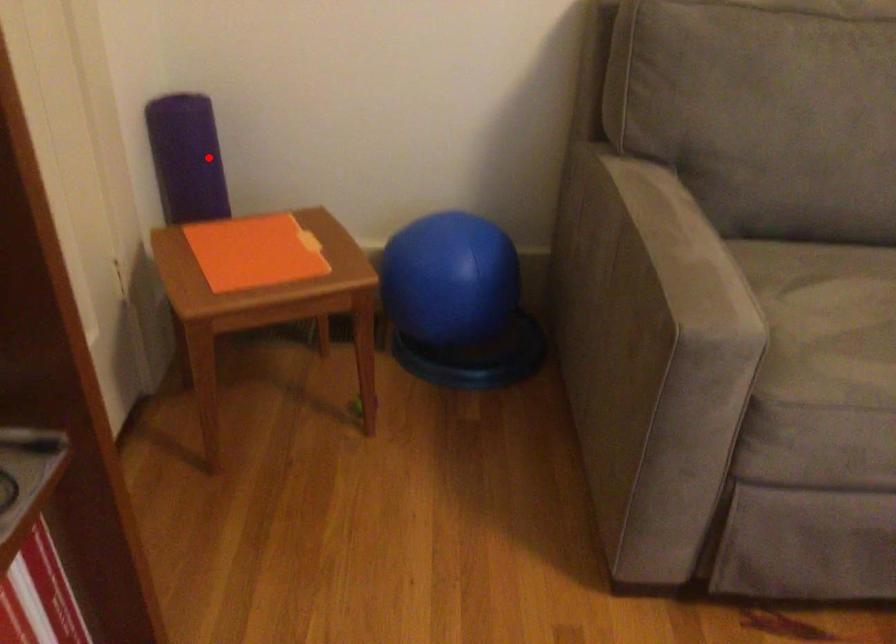
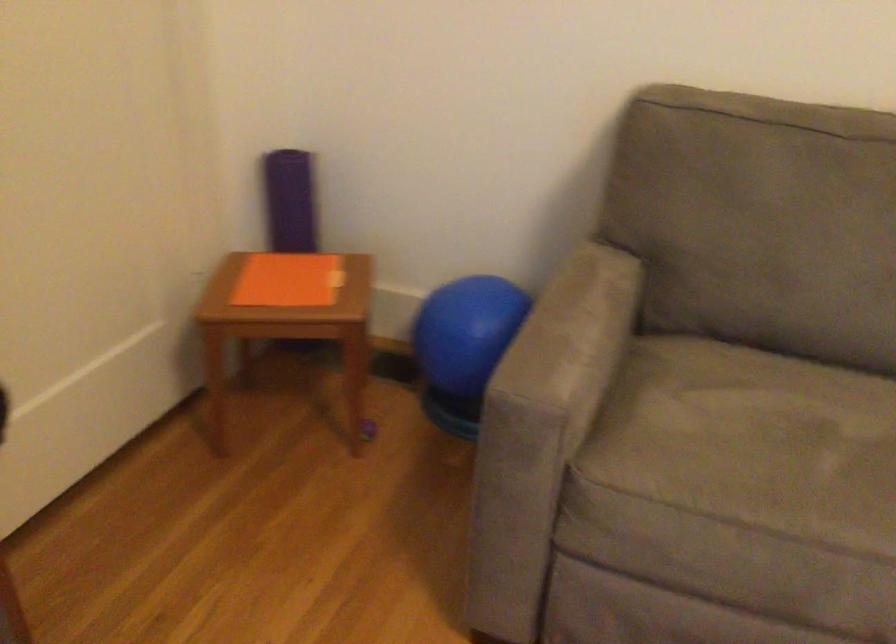
Find the pixel in the second image that matches the highlighted location in the first image.

(289, 201)